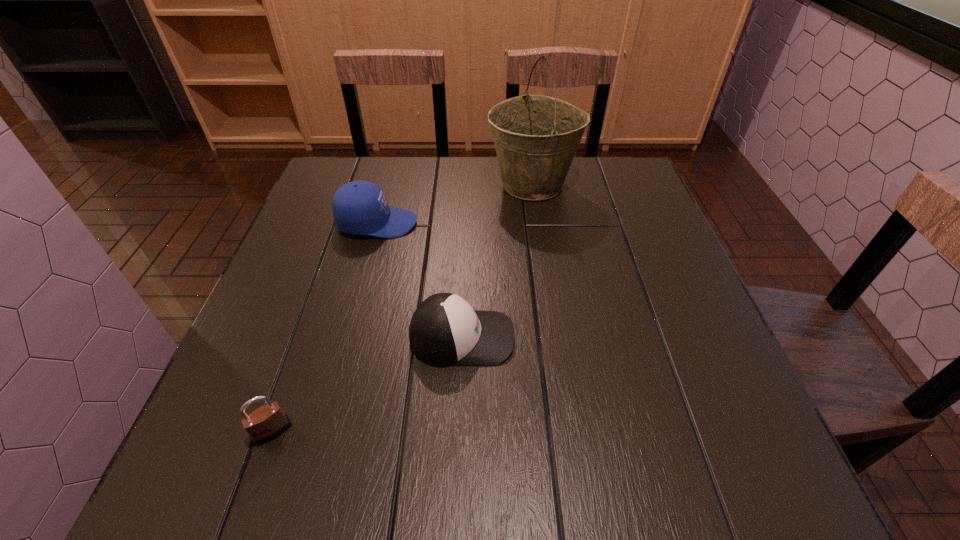
Select which object is the closest to the farther cap. Please provide its 2D coordinates. Your answer should be formatted as a tuple, i.e. [(x, y)], where the tuple contains the x and y coordinates of a point satisfying the conditions above.

[(536, 137)]

Where is `blank space that satisfies the following two spatial constraints: 1. on the front side of the wine bucket; 2. on the front panel of the second nearest object`? The width and height of the screenshot is (960, 540). blank space that satisfies the following two spatial constraints: 1. on the front side of the wine bucket; 2. on the front panel of the second nearest object is located at coordinates (556, 338).

You are a GUI agent. You are given a task and a screenshot of the screen. Output one action in this format:
    pyautogui.click(x=<x>, y=<y>)
    Task: Click on the free space that satisfies the following two spatial constraints: 1. on the front panel of the third farthest object; 2. on the front side of the padlock
    The width and height of the screenshot is (960, 540).
    Given the screenshot: What is the action you would take?
    pyautogui.click(x=459, y=431)